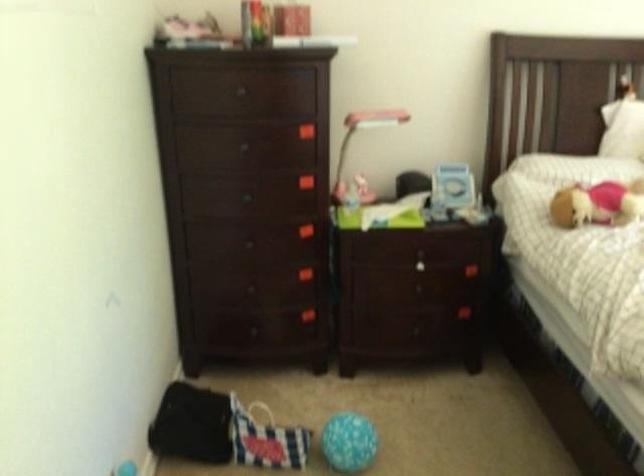
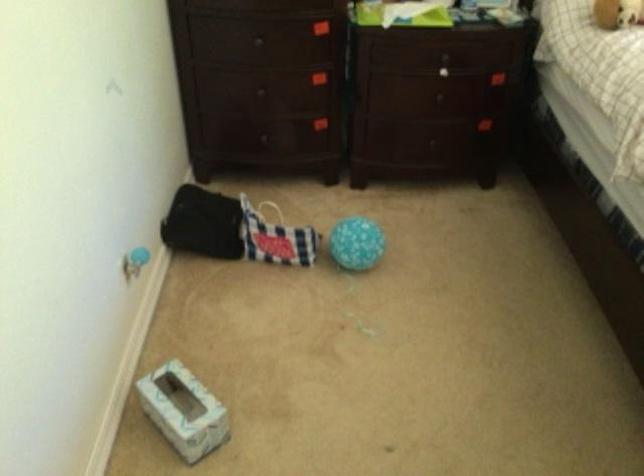
In the second image, find the point that corresponds to (x=247, y=332) in the first image.

(263, 138)